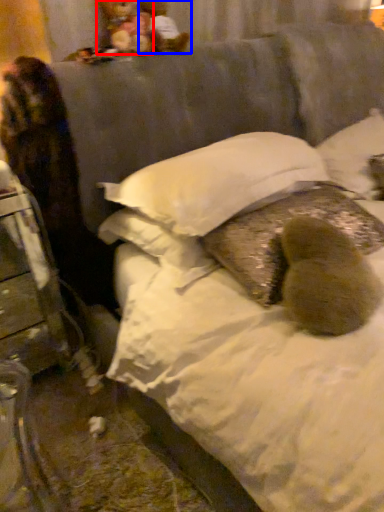
Question: Which object appears farthest to the camera in this image, figurine (highlighted by a red box) or figurine (highlighted by a blue box)?

Choices:
 (A) figurine
 (B) figurine

Answer: (B)